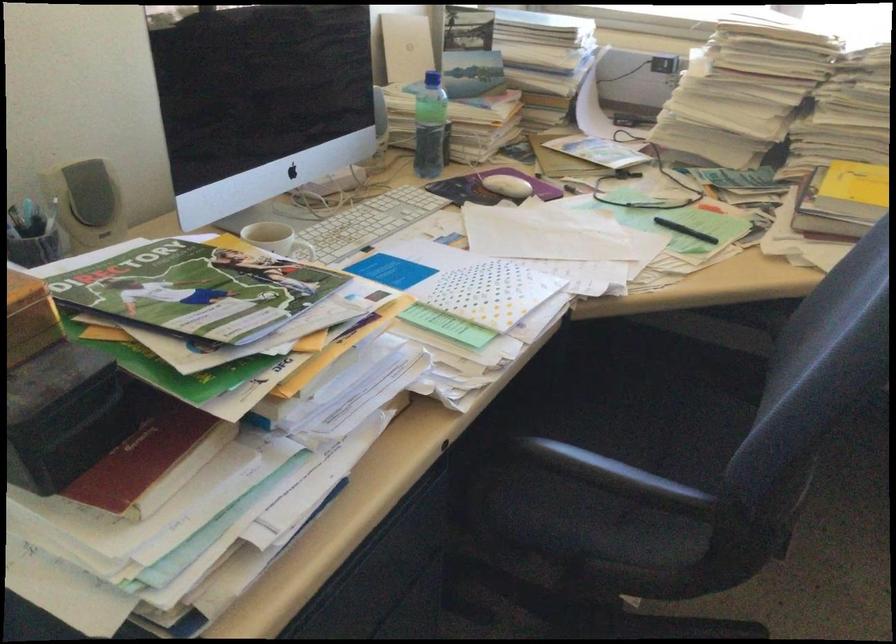
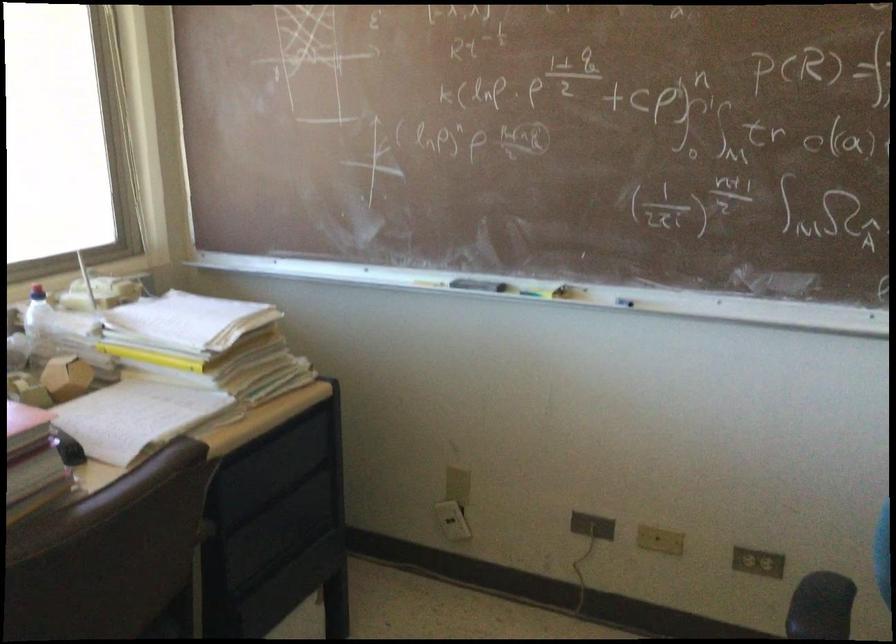
Based on the continuous images, in which direction is the camera rotating?

The camera rotated toward right-down.